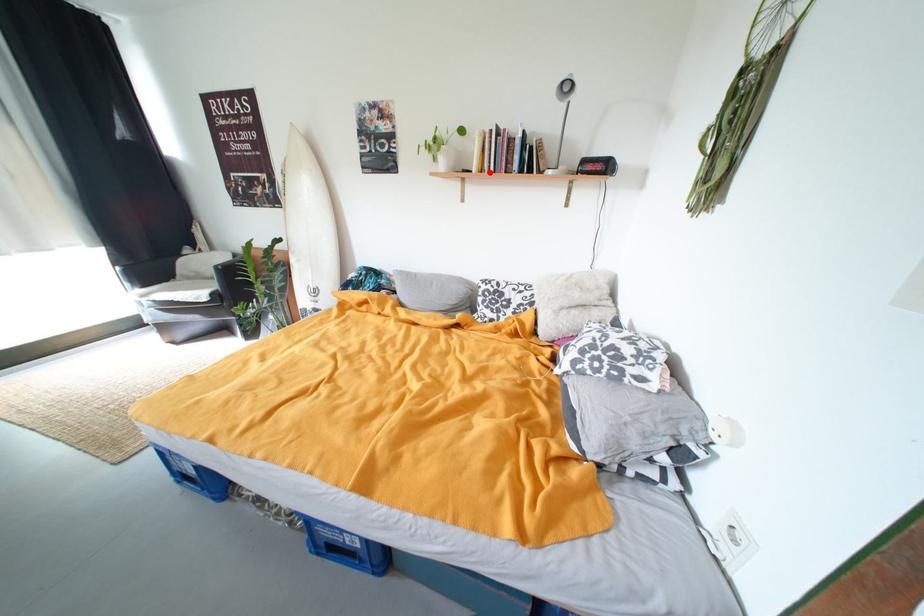
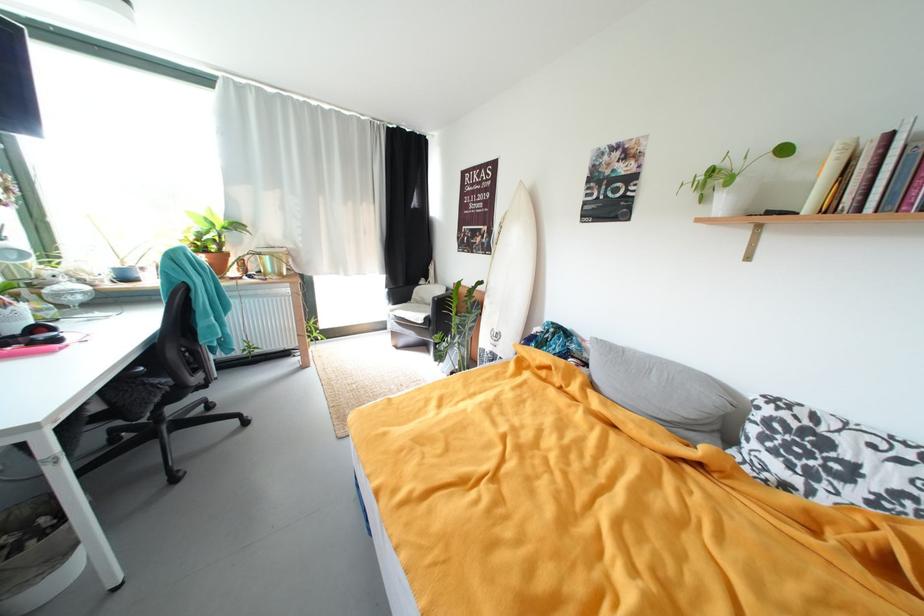
Where in the second image is the point corresponding to the highlighted location from the first image?

(837, 212)